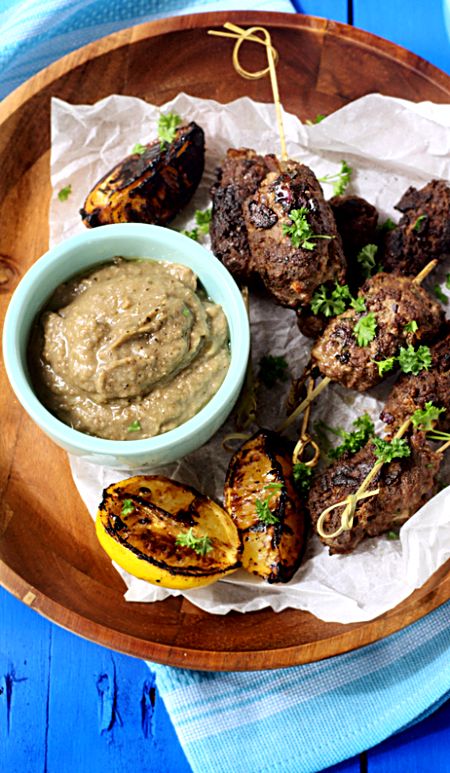
Locate an element on the screen. cyan small bowl of dip is located at coordinates (181, 243).